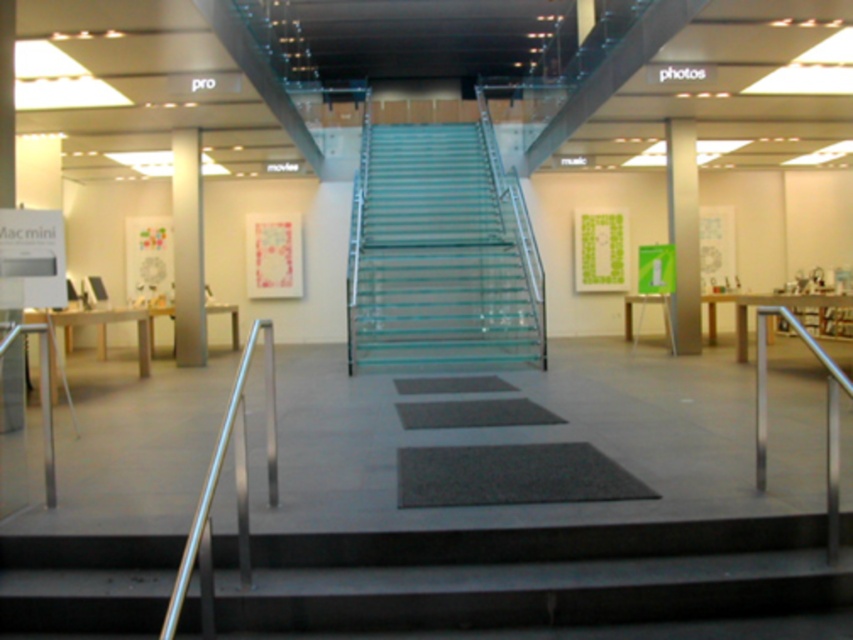
You are standing at the entrance of the store and see the point marked at coordinates (x=187, y=250). Based on the store layout described, which object is this point located on?

The point is located on the metallic gray pillar at center.

You are a customer entering the store and want to find the Mac mini display. You see the black rubber mat at center and the metallic gray pillar at center. Which object is closer to the floor?

The black rubber mat at center is shorter than the metallic gray pillar at center, so the black rubber mat at center is closer to the floor.